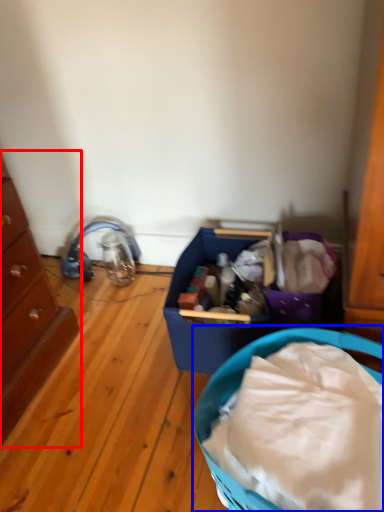
Question: Which object appears farthest to the camera in this image, chest of drawers (highlighted by a red box) or basket container (highlighted by a blue box)?

Choices:
 (A) chest of drawers
 (B) basket container

Answer: (A)